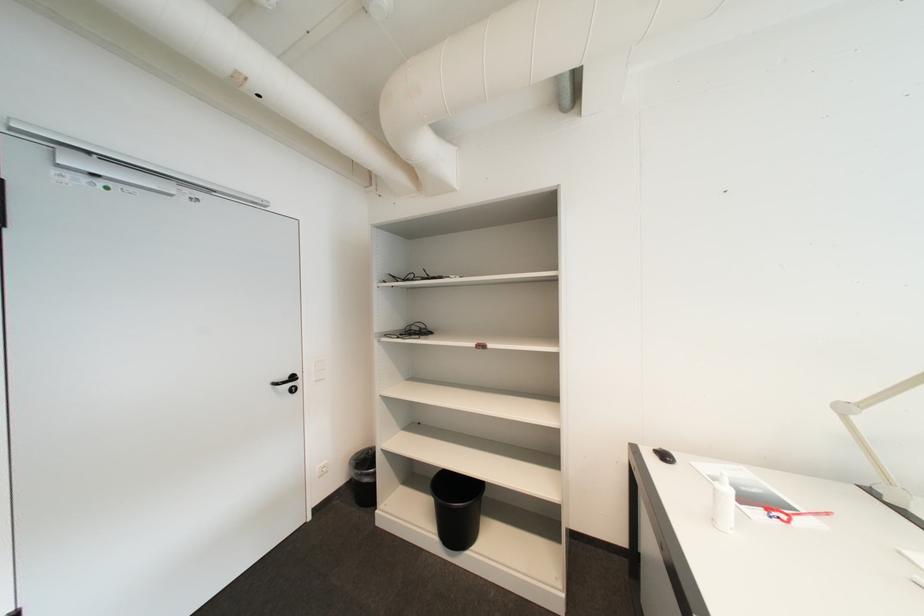
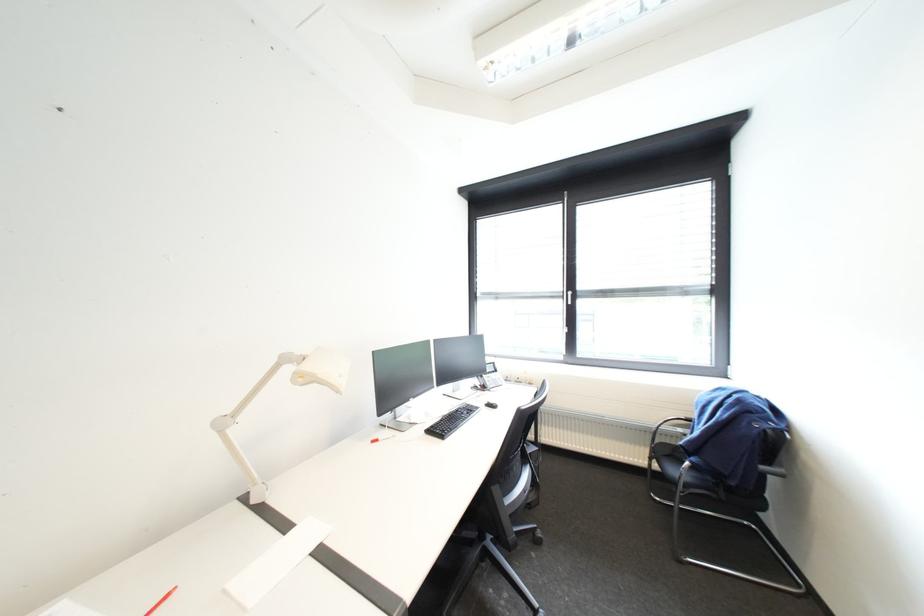
Question: The camera is either moving clockwise (left) or counter-clockwise (right) around the object. The first image is from the beginning of the video and the second image is from the end. Is the camera moving left or right when shooting the video?

Choices:
 (A) Left
 (B) Right

Answer: (A)